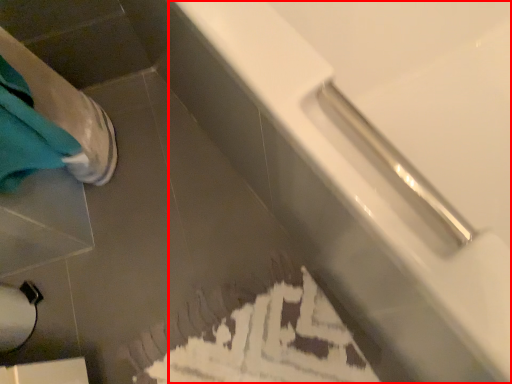
Question: Considering the relative positions of bathtub (annotated by the red box) and toilet paper in the image provided, where is bathtub (annotated by the red box) located with respect to the staircase?

Choices:
 (A) left
 (B) right

Answer: (B)